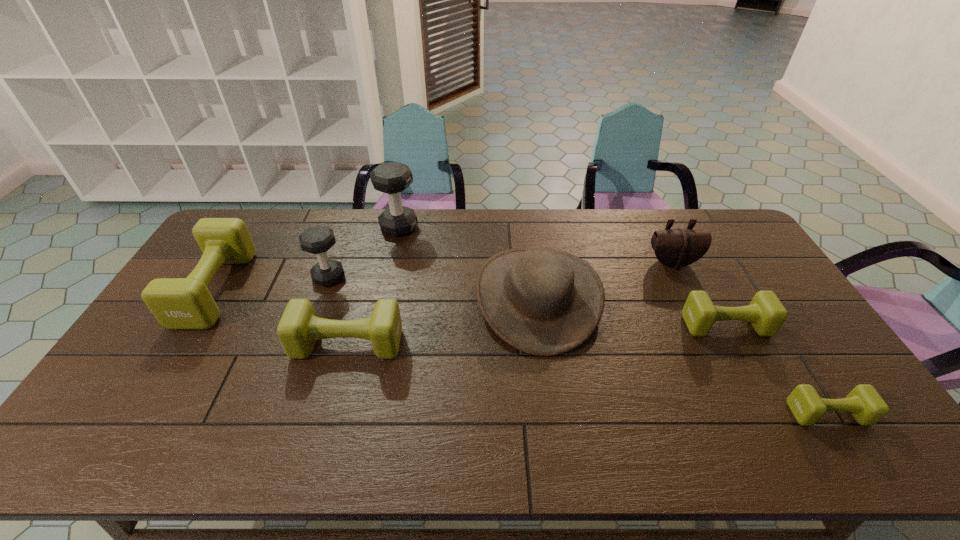
This screenshot has width=960, height=540. What are the coordinates of `the second biggest olive dumbbell` in the screenshot? It's located at (299, 328).

Where is `the fifth tallest dumbbell`? The image size is (960, 540). the fifth tallest dumbbell is located at coordinates (766, 313).

This screenshot has height=540, width=960. What are the coordinates of `the third biggest olive dumbbell` in the screenshot? It's located at (766, 313).

What are the coordinates of `the shortest object` in the screenshot? It's located at (865, 404).

The width and height of the screenshot is (960, 540). I want to click on the nearest object, so click(x=865, y=404).

Where is `vacant area located on the left of the tallest object`? The height and width of the screenshot is (540, 960). vacant area located on the left of the tallest object is located at coordinates (348, 227).

The width and height of the screenshot is (960, 540). I want to click on vacant space located 0.110m on the back of the nearer gray dumbbell, so click(341, 246).

Locate an element on the screen. Image resolution: width=960 pixels, height=540 pixels. vacant space located 0.130m with the flap open on the brown pouch is located at coordinates (690, 300).

At what (x,y) coordinates should I click in order to perform the action: click on free space located on the front of the leftmost dumbbell. Please return your answer as a coordinate pair (x, y). Looking at the image, I should click on (177, 351).

Find the location of `vacant region located 0.220m on the right of the cowboy hat`. vacant region located 0.220m on the right of the cowboy hat is located at coordinates (670, 296).